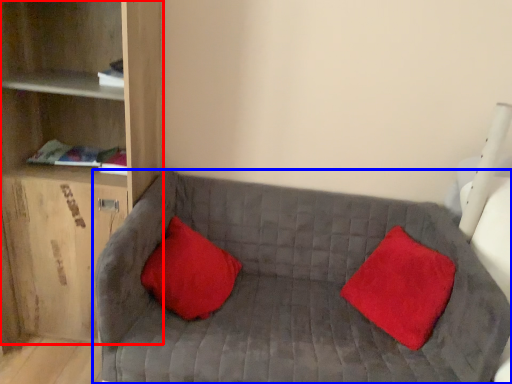
Question: Which object appears closest to the camera in this image, shelf (highlighted by a red box) or studio couch (highlighted by a blue box)?

Choices:
 (A) shelf
 (B) studio couch

Answer: (B)